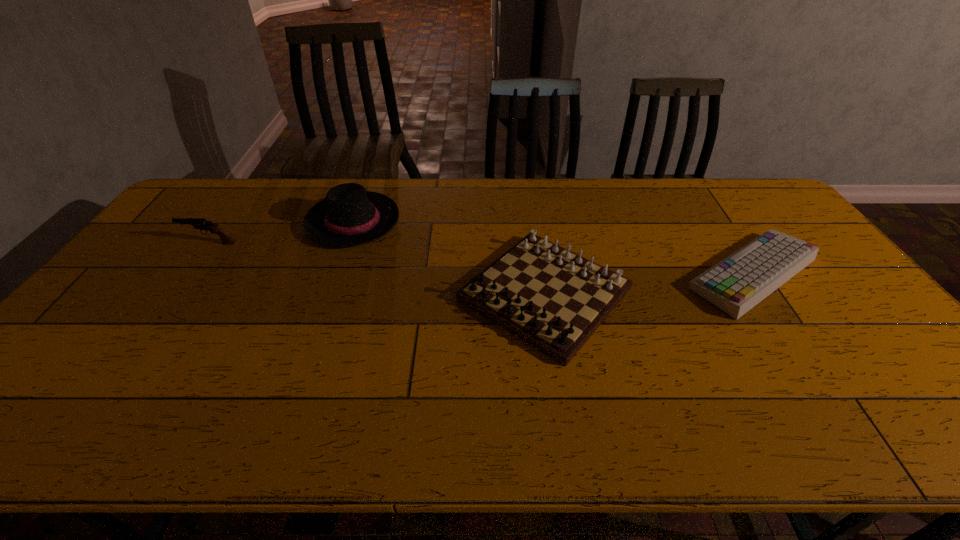
The image size is (960, 540). Identify the location of object situated at the left edge. (198, 223).

Locate an element on the screen. This screenshot has width=960, height=540. object situated at the right edge is located at coordinates (739, 282).

The image size is (960, 540). I want to click on vacant space at the far edge, so click(467, 199).

This screenshot has width=960, height=540. Find the location of `free spot at the near edge of the desktop`. free spot at the near edge of the desktop is located at coordinates tap(725, 433).

Locate an element on the screen. The image size is (960, 540). free space at the left edge of the desktop is located at coordinates (190, 216).

In the image, there is a desktop. Find the location of `vacant space at the far right corner`. vacant space at the far right corner is located at coordinates (761, 200).

Locate an element on the screen. free space between the gun and the third tallest object is located at coordinates (377, 268).

You are a GUI agent. You are given a task and a screenshot of the screen. Output one action in this format:
    pyautogui.click(x=<x>, y=<y>)
    Task: Click on the free space between the shortest object and the leftmost object
    This screenshot has width=960, height=540.
    Given the screenshot: What is the action you would take?
    pyautogui.click(x=481, y=259)

At what (x,y) coordinates should I click in order to perform the action: click on vacant point located between the leftmost object and the second object from right to left. Please return your answer as a coordinate pair (x, y). Looking at the image, I should click on (377, 268).

At what (x,y) coordinates should I click in order to perform the action: click on vacant space that's between the chessboard and the leftmost object. Please return your answer as a coordinate pair (x, y). Looking at the image, I should click on (377, 268).